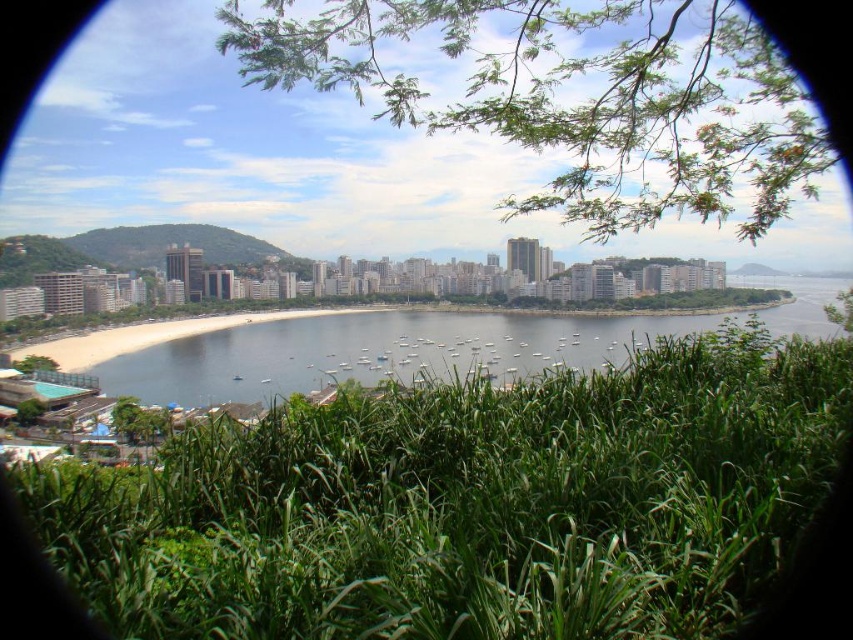
Question: Is green leafy grass at lower center bigger than clear blue water at center?

Choices:
 (A) yes
 (B) no

Answer: (A)

Question: Which of the following is the farthest from the observer?

Choices:
 (A) clear blue water at center
 (B) green leafy grass at lower center

Answer: (A)

Question: Among these objects, which one is farthest from the camera?

Choices:
 (A) clear blue water at center
 (B) green leafy grass at lower center

Answer: (A)

Question: Observing the image, what is the correct spatial positioning of green leafy grass at lower center in reference to clear blue water at center?

Choices:
 (A) right
 (B) left

Answer: (B)

Question: Is green leafy grass at lower center below clear blue water at center?

Choices:
 (A) no
 (B) yes

Answer: (B)